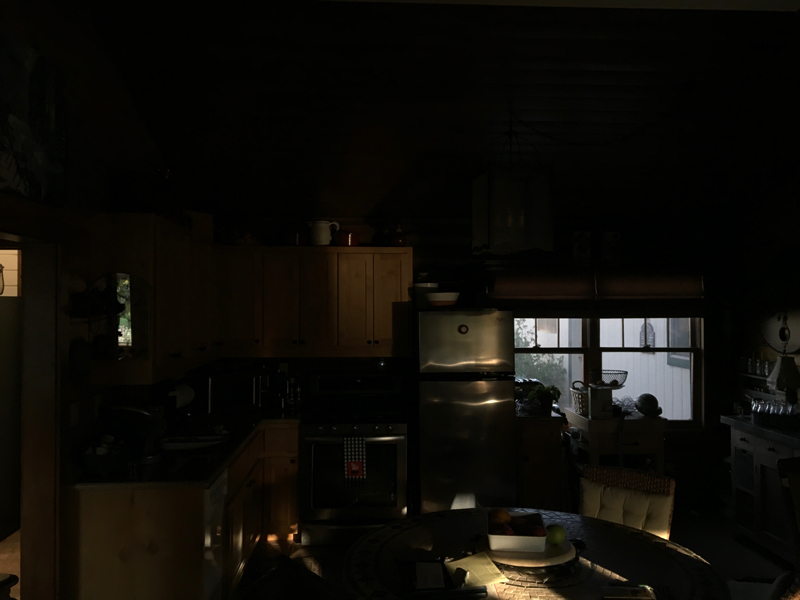
At what (x,y) coordinates should I click in order to perform the action: click on sink. Please return your answer as a coordinate pair (x, y). Looking at the image, I should click on (180, 442).